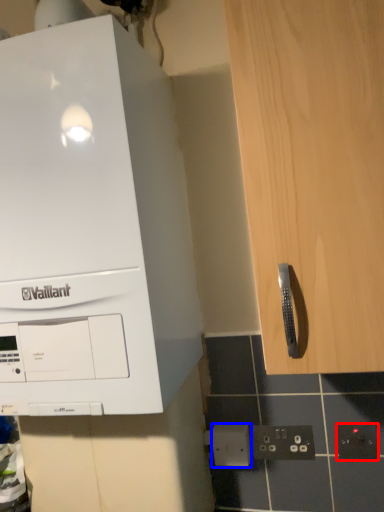
Question: Which object appears closest to the camera in this image, electric outlet (highlighted by a red box) or electric outlet (highlighted by a blue box)?

Choices:
 (A) electric outlet
 (B) electric outlet

Answer: (A)